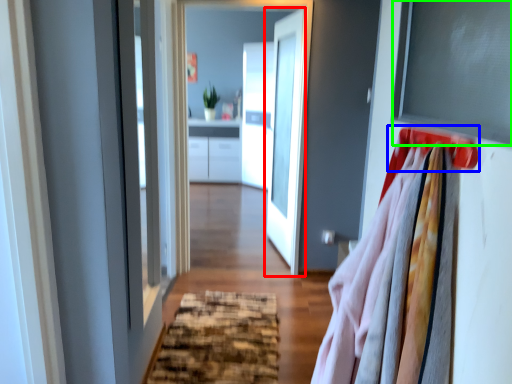
Question: Estimate the real-world distances between objects in this image. Which object is closer to door (highlighted by a red box), hanger (highlighted by a blue box) or window screen (highlighted by a green box)?

Choices:
 (A) hanger
 (B) window screen

Answer: (B)